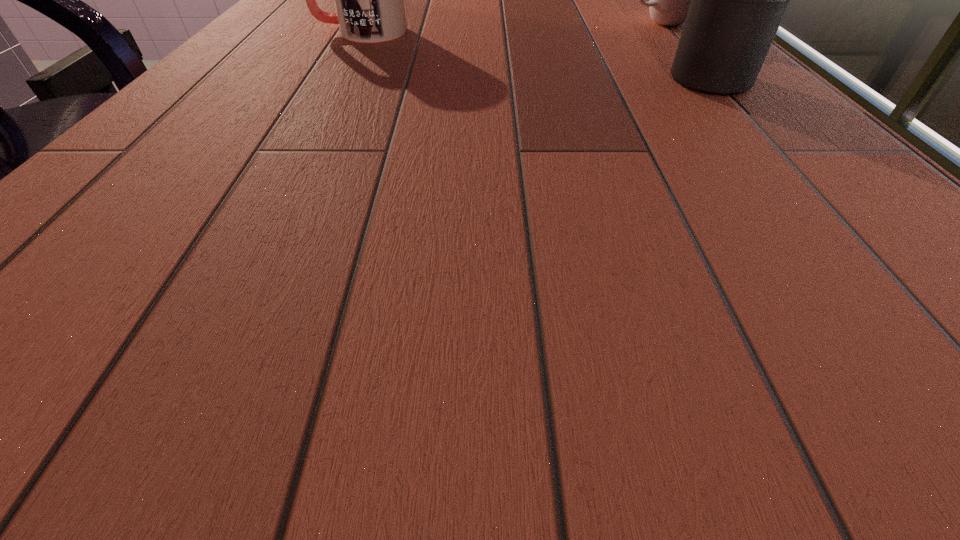
You are a GUI agent. You are given a task and a screenshot of the screen. Output one action in this format:
    pyautogui.click(x=<x>, y=<y>)
    Task: Click on the vacant spot on the desktop that is between the mug and the jar and is positioned with the handle on the side of the cup
    This screenshot has width=960, height=540.
    Given the screenshot: What is the action you would take?
    pyautogui.click(x=473, y=48)